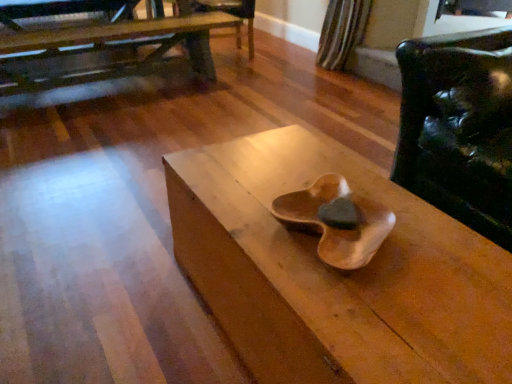
Question: From their relative heights in the image, would you say wooden armchair at center is taller or shorter than wooden table at upper left, positioned as the 2th table in bottom-to-top order?

Choices:
 (A) short
 (B) tall

Answer: (A)

Question: Is wooden armchair at center bigger or smaller than wooden table at upper left, positioned as the second table in front-to-back order?

Choices:
 (A) small
 (B) big

Answer: (A)

Question: Estimate the real-world distances between objects in this image. Which object is farther from the glossy leather chair at right?

Choices:
 (A) wooden armchair at center
 (B) wooden table at center, which is the 1th table from right to left
 (C) wooden table at upper left, which ranks as the first table in top-to-bottom order

Answer: (C)

Question: Considering the real-world distances, which object is closest to the glossy leather chair at right?

Choices:
 (A) wooden table at center, which ranks as the 2th table in back-to-front order
 (B) wooden table at upper left, arranged as the 1th table when viewed from the left
 (C) wooden armchair at center

Answer: (A)